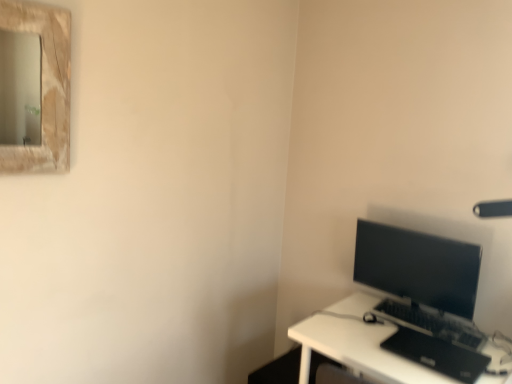
Where is `free spot above black matte laptop at lower right (from a real-world perspective)`? The width and height of the screenshot is (512, 384). free spot above black matte laptop at lower right (from a real-world perspective) is located at coordinates (439, 343).